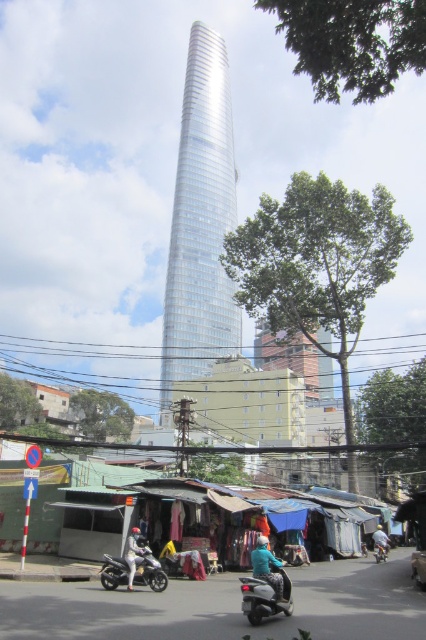
Question: Is metallic silver scooter at center to the left of teal matte jacket at center from the viewer's perspective?

Choices:
 (A) no
 (B) yes

Answer: (B)

Question: Does metallic silver scooter at center appear over silver metallic motorcycle at lower left?

Choices:
 (A) no
 (B) yes

Answer: (B)

Question: Can you confirm if metallic silver scooter at center is positioned to the left of white matte helmet at center?

Choices:
 (A) no
 (B) yes

Answer: (A)

Question: Which of the following is the farthest from the observer?

Choices:
 (A) silver glass tower at center
 (B) metallic silver scooter at center

Answer: (A)

Question: Which object is farther from the camera taking this photo?

Choices:
 (A) metallic silver motorcycle at center
 (B) teal matte jacket at center

Answer: (A)

Question: Which object is the farthest from the white matte helmet at center?

Choices:
 (A) metallic silver scooter at center
 (B) silver glass tower at center

Answer: (B)